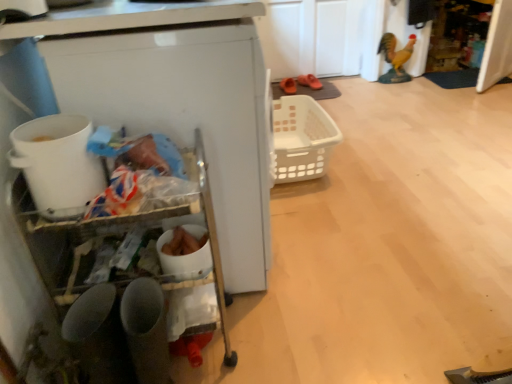
Locate an element on the screen. vacant space to the left of shiny gold statue at upper right is located at coordinates (362, 84).